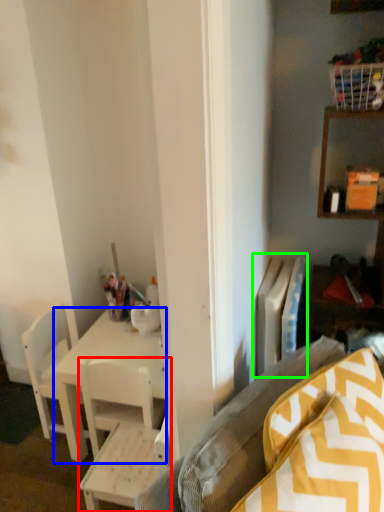
Question: Which is nearer to the chair (highlighted by a red box)? desk (highlighted by a blue box) or radiator (highlighted by a green box).

Choices:
 (A) desk
 (B) radiator

Answer: (A)